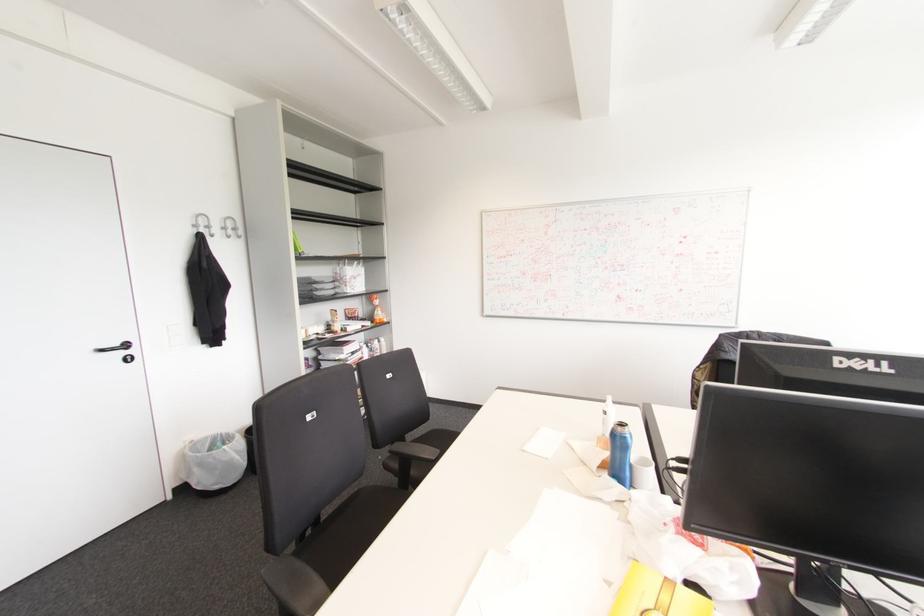
Where would you lift the orange snack package? Please return your answer as a coordinate pair (x, y).

(657, 596)